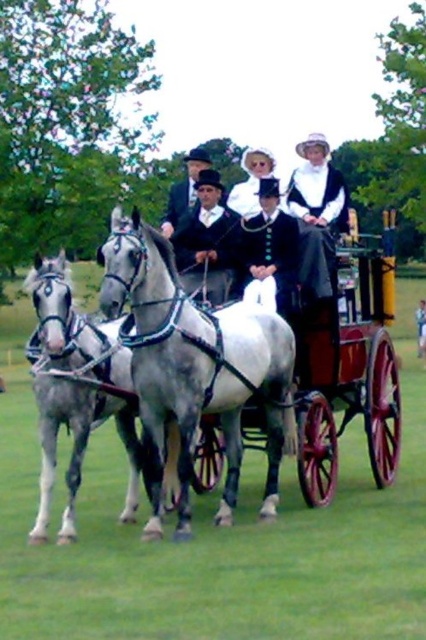
Question: Is smooth black coat at center thinner than smooth leather coach at center?

Choices:
 (A) yes
 (B) no

Answer: (A)

Question: Does smooth black coat at center appear on the right side of smooth leather coach at center?

Choices:
 (A) no
 (B) yes

Answer: (B)

Question: Which of the following is the closest to the observer?

Choices:
 (A) gray glossy horse at center
 (B) white glossy horse at center
 (C) smooth leather coach at center

Answer: (A)

Question: Which of the following is the farthest from the observer?

Choices:
 (A) (221, 266)
 (B) (313, 264)
 (C) (178, 209)
 (D) (46, 506)

Answer: (C)

Question: Which point is farther to the camera?

Choices:
 (A) (173, 200)
 (B) (160, 323)

Answer: (A)

Question: Does gray glossy horse at center have a smaller size compared to smooth black coat at center?

Choices:
 (A) yes
 (B) no

Answer: (B)